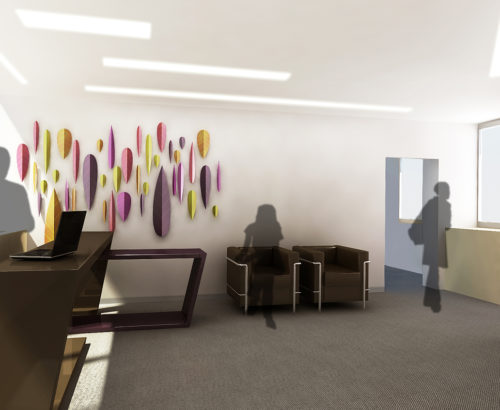
Where is `floor`? The height and width of the screenshot is (410, 500). floor is located at coordinates (276, 385).